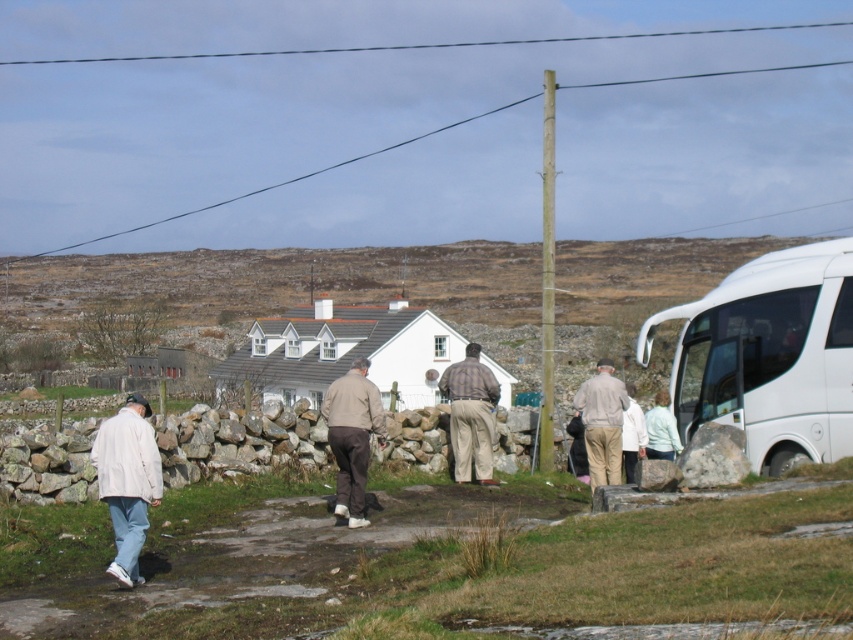
Based on the photo, you are a photographer trying to capture both the white matte jacket at lower left and the light brown fabric jacket at center in a single frame. Given that your camera has a fixed focus range, which jacket should you adjust your focus on to ensure both are in the frame?

The white matte jacket at lower left is larger in width than the light brown fabric jacket at center. To ensure both are in focus, you should adjust your focus on the white matte jacket at lower left since it requires more space in the frame.

You are a photographer trying to capture the entire scene of the white glossy van at right and the light brown fabric pants at center in one shot. Since the van is larger, will you need to move closer to the van or farther away from it to ensure both are in frame?

The white glossy van at right is bigger than the light brown fabric pants at center. To include both in the frame, you should move farther away from the van so that its larger size doesn